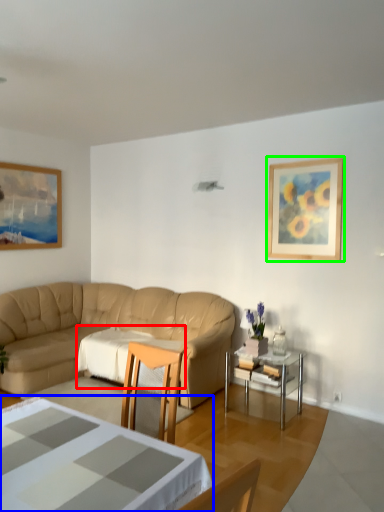
Question: Based on their relative distances, which object is farther from tablecloth (highlighted by a red box)? Choose from coffee table (highlighted by a blue box) and picture frame (highlighted by a green box).

Choices:
 (A) coffee table
 (B) picture frame

Answer: (A)